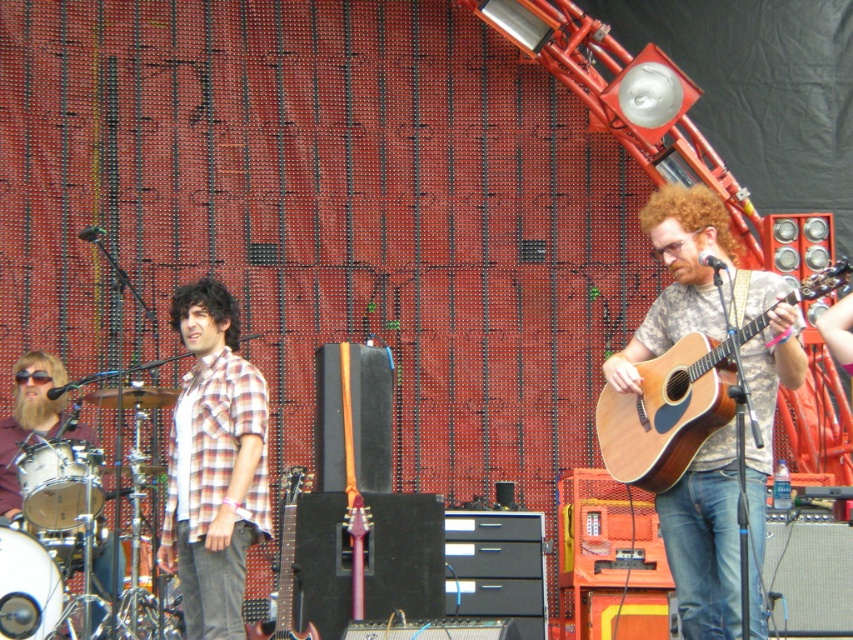
This screenshot has width=853, height=640. What are the coordinates of `wooden acoustic guitar at right` in the screenshot? It's located at (689, 280).

Describe the element at coordinates (689, 280) in the screenshot. The width and height of the screenshot is (853, 640). I see `wooden acoustic guitar at right` at that location.

At what (x,y) coordinates should I click in order to perform the action: click on wooden acoustic guitar at right. Please return your answer as a coordinate pair (x, y). The width and height of the screenshot is (853, 640). Looking at the image, I should click on (689, 280).

Who is more distant from viewer, (165,532) or (289,636)?

The point (289,636) is behind.

Does point (206, 410) come in front of point (276, 589)?

Yes, it is in front of point (276, 589).

Find the location of a particular element. Image resolution: width=853 pixels, height=640 pixels. plaid cotton shirt at center is located at coordinates (213, 465).

Does wooden acoustic guitar at right have a lesser width compared to natural wood acoustic guitar at right?

In fact, wooden acoustic guitar at right might be wider than natural wood acoustic guitar at right.

Is wooden acoustic guitar at right shorter than natural wood acoustic guitar at right?

In fact, wooden acoustic guitar at right may be taller than natural wood acoustic guitar at right.

Image resolution: width=853 pixels, height=640 pixels. I want to click on wooden acoustic guitar at right, so click(689, 280).